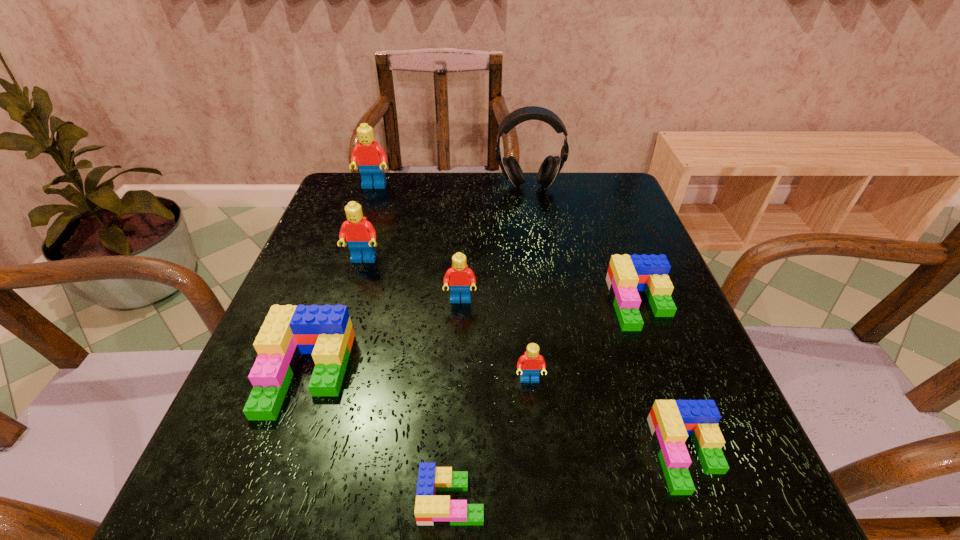
Select which green Lego is the closest to the third red Lego from left to right. Please provide its 2D coordinates. Your answer should be formatted as a tuple, i.e. [(x, y)], where the tuple contains the x and y coordinates of a point satisfying the conditions above.

[(326, 332)]

You are a GUI agent. You are given a task and a screenshot of the screen. Output one action in this format:
    pyautogui.click(x=<x>, y=<y>)
    Task: Click on the closest green Lego to the second tallest object
    The height and width of the screenshot is (540, 960).
    Given the screenshot: What is the action you would take?
    pyautogui.click(x=326, y=332)

Identify the location of vacant position in the image that satisfies the following two spatial constraints: 1. on the face of the second farthest Lego; 2. on the left side of the seventh tallest Lego. (304, 454).